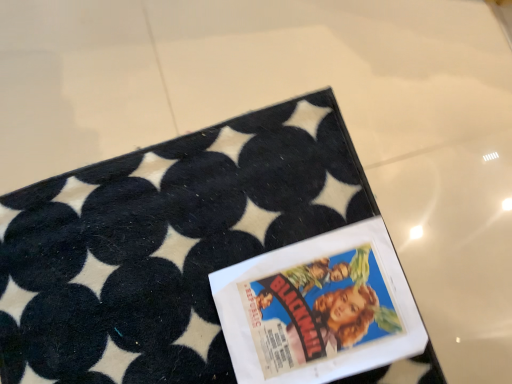
In order to click on black felt rug at upper center in this screenshot , I will do [164, 244].

The image size is (512, 384). What do you see at coordinates (164, 244) in the screenshot? I see `black felt rug at upper center` at bounding box center [164, 244].

Identify the location of matte paper comic book at center. (319, 308).

What do you see at coordinates (319, 308) in the screenshot? I see `matte paper comic book at center` at bounding box center [319, 308].

You are a GUI agent. You are given a task and a screenshot of the screen. Output one action in this format:
    pyautogui.click(x=<x>, y=<y>)
    Task: Click on the black felt rug at upper center
    
    Given the screenshot: What is the action you would take?
    pyautogui.click(x=164, y=244)

Considering the positions of objects black felt rug at upper center and matte paper comic book at center in the image provided, who is more to the right, black felt rug at upper center or matte paper comic book at center?

Positioned to the right is matte paper comic book at center.

Who is more distant, black felt rug at upper center or matte paper comic book at center?

matte paper comic book at center is more distant.

Does point (73, 251) come farther from viewer compared to point (424, 347)?

Yes, point (73, 251) is farther from viewer.

From the image's perspective, is black felt rug at upper center above or below matte paper comic book at center?

black felt rug at upper center is situated higher than matte paper comic book at center in the image.

From a real-world perspective, is black felt rug at upper center positioned above or below matte paper comic book at center?

black felt rug at upper center is above matte paper comic book at center.

Is black felt rug at upper center thinner than matte paper comic book at center?

No.

Considering the relative sizes of black felt rug at upper center and matte paper comic book at center in the image provided, is black felt rug at upper center shorter than matte paper comic book at center?

Yes.

Who is bigger, black felt rug at upper center or matte paper comic book at center?

Bigger between the two is black felt rug at upper center.

From the picture: Is black felt rug at upper center located outside matte paper comic book at center?

Yes, black felt rug at upper center is not within matte paper comic book at center.

Is black felt rug at upper center beside matte paper comic book at center?

No, black felt rug at upper center is not with matte paper comic book at center.

Is black felt rug at upper center facing away from matte paper comic book at center?

No, matte paper comic book at center is not at the back of black felt rug at upper center.

What's the angular difference between black felt rug at upper center and matte paper comic book at center's facing directions?

black felt rug at upper center and matte paper comic book at center are facing 0.327 degrees away from each other.

Locate an element on the screen. The image size is (512, 384). comic book beneath the black felt rug at upper center (from a real-world perspective) is located at coordinates (319, 308).

Which is more to the right, matte paper comic book at center or black felt rug at upper center?

Positioned to the right is matte paper comic book at center.

Is the position of matte paper comic book at center less distant than that of black felt rug at upper center?

That is False.

Is point (396, 319) farther from camera compared to point (134, 163)?

No.

From the image's perspective, which is above, matte paper comic book at center or black felt rug at upper center?

black felt rug at upper center is shown above in the image.

From a real-world perspective, between matte paper comic book at center and black felt rug at upper center, who is vertically lower?

matte paper comic book at center, from a real-world perspective.

Can you confirm if matte paper comic book at center is wider than black felt rug at upper center?

No, matte paper comic book at center is not wider than black felt rug at upper center.

Can you confirm if matte paper comic book at center is taller than black felt rug at upper center?

Correct, matte paper comic book at center is much taller as black felt rug at upper center.

Which of these two, matte paper comic book at center or black felt rug at upper center, is bigger?

black felt rug at upper center is bigger.

Do you think matte paper comic book at center is within black felt rug at upper center, or outside of it?

matte paper comic book at center is contained in black felt rug at upper center.

Is matte paper comic book at center beside black felt rug at upper center?

matte paper comic book at center and black felt rug at upper center are not in contact.

Is matte paper comic book at center turned away from black felt rug at upper center?

Yes, matte paper comic book at center is positioned with its back facing black felt rug at upper center.

How far apart are matte paper comic book at center and black felt rug at upper center?

matte paper comic book at center is 12.60 centimeters from black felt rug at upper center.

The width and height of the screenshot is (512, 384). I want to click on comic book located behind the black felt rug at upper center, so click(x=319, y=308).

The width and height of the screenshot is (512, 384). Find the location of `comic book behind the black felt rug at upper center`. comic book behind the black felt rug at upper center is located at coordinates (319, 308).

You are a GUI agent. You are given a task and a screenshot of the screen. Output one action in this format:
    pyautogui.click(x=<x>, y=<y>)
    Task: Click on the tray that appears in front of the matte paper comic book at center
    
    Given the screenshot: What is the action you would take?
    pyautogui.click(x=164, y=244)